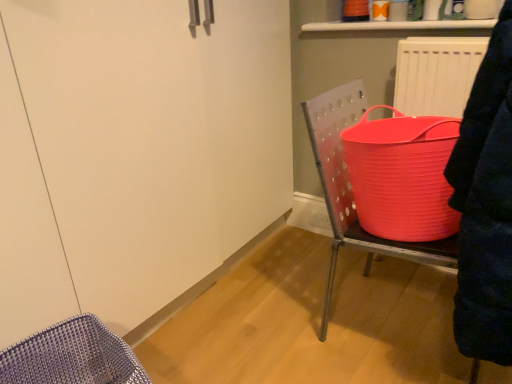
This screenshot has width=512, height=384. What are the coordinates of `vacant space behind rubberized plastic bucket at right` in the screenshot? It's located at (350, 263).